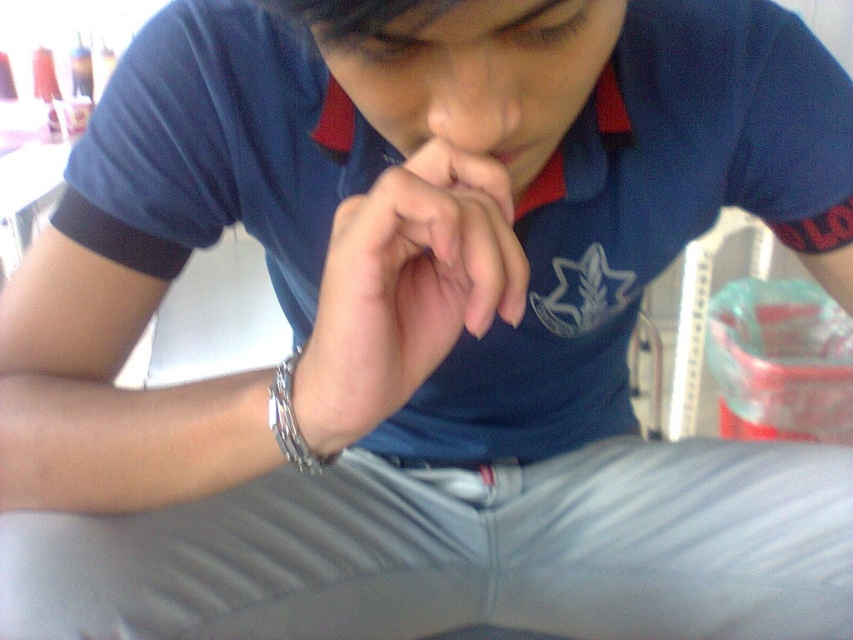
Find the location of a particular element. The height and width of the screenshot is (640, 853). smooth skin hands at center is located at coordinates (405, 289).

Between point (399, 179) and point (277, 435), which one is positioned in front?

Positioned in front is point (399, 179).

What do you see at coordinates (405, 289) in the screenshot?
I see `smooth skin hands at center` at bounding box center [405, 289].

At what (x,y) coordinates should I click in order to perform the action: click on smooth skin hands at center. Please return your answer as a coordinate pair (x, y). The height and width of the screenshot is (640, 853). Looking at the image, I should click on (405, 289).